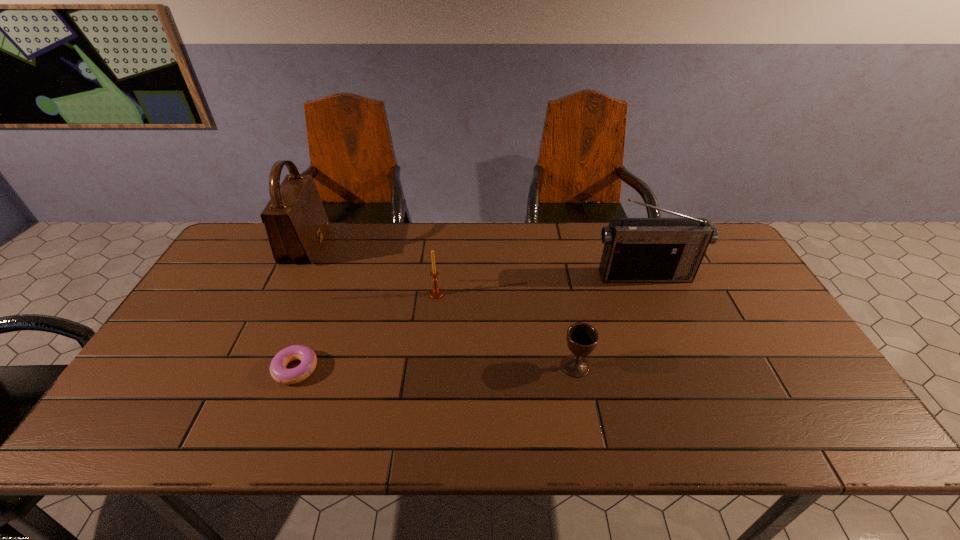
In order to click on free space between the shortest object and the shoulder bag in this screenshot , I will do [x=300, y=307].

The height and width of the screenshot is (540, 960). I want to click on free space that is in between the shortest object and the rightmost object, so click(x=470, y=322).

Where is `empty space between the second shortest object and the shoulder bag`? The height and width of the screenshot is (540, 960). empty space between the second shortest object and the shoulder bag is located at coordinates (441, 306).

The width and height of the screenshot is (960, 540). What are the coordinates of `free area in between the second shortest object and the rightmost object` in the screenshot? It's located at (611, 321).

Image resolution: width=960 pixels, height=540 pixels. Identify the location of free point between the third tallest object and the shortest object. (366, 332).

Find the location of a particular element. The image size is (960, 540). vacant area that lies between the fourth object from right to left and the rightmost object is located at coordinates (470, 322).

You are a GUI agent. You are given a task and a screenshot of the screen. Output one action in this format:
    pyautogui.click(x=<x>, y=<y>)
    Task: Click on the empty space that is in between the radio receiver and the shoulder bag
    The width and height of the screenshot is (960, 540).
    Given the screenshot: What is the action you would take?
    pyautogui.click(x=475, y=260)

Locate an element on the screen. free space between the leftmost object and the third farthest object is located at coordinates (371, 269).

The width and height of the screenshot is (960, 540). What are the coordinates of `vacant space in between the shortest object and the chalice` in the screenshot? It's located at (436, 368).

Locate an element on the screen. unoccupied area between the shoulder bag and the second shortest object is located at coordinates (441, 306).